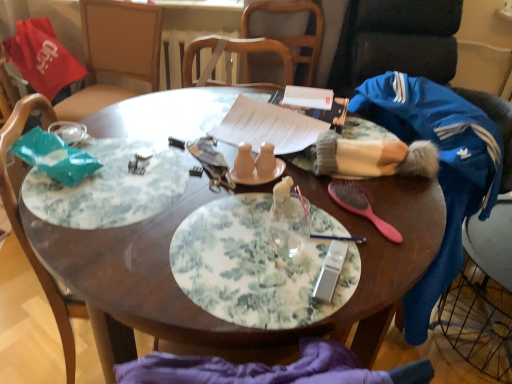
I want to click on free space that is in between matte ceramic salt and pepper shakers at center, arranged as the third tableware when viewed from the right, and metallic silver pen at center, which appears as the fourth tableware when viewed from the left, so click(x=314, y=217).